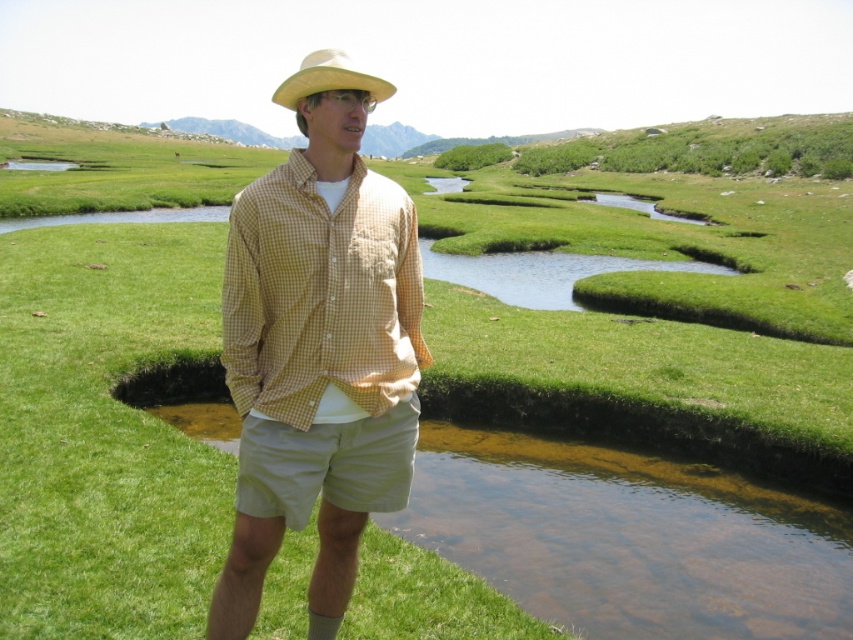
You are a hiker who wants to know which hat is higher up in the image. You see the matte yellow hat at center and the yellow straw hat at upper center. Which one is positioned higher?

The yellow straw hat at upper center is positioned higher than the matte yellow hat at center.

You are a fashion designer observing the person in the image. You need to determine if the khaki cotton shorts at center will be visible above the yellow straw hat at upper center when the person bends forward to pick up a rock from the stream. Based on their current positions, what do you think?

The khaki cotton shorts at center has a lesser height compared to the yellow straw hat at upper center. When the person bends forward, the shorts will likely be hidden below the hat since they are shorter in height.

You are a fashion designer analyzing the outfit of a person in an outdoor setting. You need to determine which item of clothing is taller between the matte yellow hat at center and the yellow checkered shirt at center. Which one is taller?

The matte yellow hat at center is taller than the yellow checkered shirt at center according to the description.